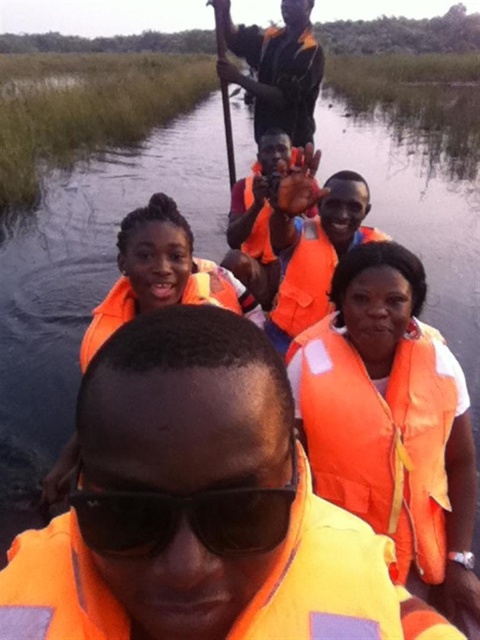
Question: Is orange life vest at center below orange life vest at upper center?

Choices:
 (A) no
 (B) yes

Answer: (B)

Question: Is orange life vest at center behind orange life vest at upper center?

Choices:
 (A) no
 (B) yes

Answer: (A)

Question: Estimate the real-world distances between objects in this image. Which object is farther from the orange/yellow fabric life jacket at center?

Choices:
 (A) orange matte life jacket at center
 (B) orange fabric life vest at center
 (C) black plastic goggles at center

Answer: (A)

Question: Among these objects, which one is nearest to the camera?

Choices:
 (A) orange fabric life vest at center
 (B) orange life vest at center
 (C) orange life jacket at upper center
 (D) orange life vest at upper center

Answer: (A)

Question: Is black plastic goggles at center in front of orange life vest at upper center?

Choices:
 (A) no
 (B) yes

Answer: (B)

Question: Which of the following is the farthest from the observer?

Choices:
 (A) orange fabric life vest at center
 (B) orange/yellow fabric life jacket at center

Answer: (A)